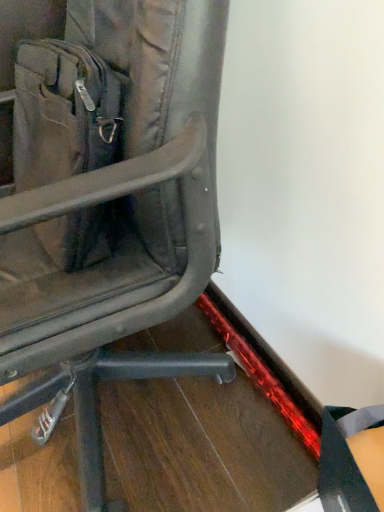
What do you see at coordinates (105, 198) in the screenshot?
I see `matte black chair at center` at bounding box center [105, 198].

What is the approximate height of matte black chair at center?

31.99 inches.

Where is `matte black chair at center`? matte black chair at center is located at coordinates (105, 198).

What is the approximate width of matte black chair at center?

matte black chair at center is 24.42 inches in width.

Locate an element on the screen. This screenshot has height=512, width=384. matte black messenger bag at left is located at coordinates 62,113.

The height and width of the screenshot is (512, 384). Describe the element at coordinates (62, 113) in the screenshot. I see `matte black messenger bag at left` at that location.

I want to click on matte black chair at center, so click(105, 198).

Which object is positioned more to the left, matte black chair at center or matte black messenger bag at left?

matte black messenger bag at left.

Is matte black chair at center closer to the viewer compared to matte black messenger bag at left?

Yes, the depth of matte black chair at center is less than that of matte black messenger bag at left.

Considering the points (61, 78) and (92, 234), which point is in front, point (61, 78) or point (92, 234)?

The point (92, 234) is more forward.

From the image's perspective, is matte black chair at center under matte black messenger bag at left?

Yes, from the image's perspective, matte black chair at center is below matte black messenger bag at left.

From a real-world perspective, is matte black chair at center physically located above or below matte black messenger bag at left?

In terms of real-world spatial position, matte black chair at center is below matte black messenger bag at left.

Consider the image. Between matte black chair at center and matte black messenger bag at left, which one has larger width?

Wider between the two is matte black chair at center.

Which of these two, matte black chair at center or matte black messenger bag at left, stands shorter?

Standing shorter between the two is matte black messenger bag at left.

Who is bigger, matte black chair at center or matte black messenger bag at left?

With larger size is matte black chair at center.

Is matte black chair at center not inside matte black messenger bag at left?

Yes, matte black chair at center is located beyond the bounds of matte black messenger bag at left.

Is matte black chair at center far away from matte black messenger bag at left?

matte black chair at center is actually quite close to matte black messenger bag at left.

Is matte black chair at center facing towards matte black messenger bag at left?

Yes.

Locate an element on the screen. chair that appears in front of the matte black messenger bag at left is located at coordinates (105, 198).

Which object is positioned more to the left, matte black messenger bag at left or matte black chair at center?

matte black messenger bag at left is more to the left.

Does matte black messenger bag at left come behind matte black chair at center?

Yes, matte black messenger bag at left is further from the viewer.

Is point (55, 87) closer to viewer compared to point (191, 230)?

No, (55, 87) is further to viewer.

From the image's perspective, relative to matte black chair at center, is matte black messenger bag at left above or below?

Based on their image positions, matte black messenger bag at left is located above matte black chair at center.

From a real-world perspective, relative to matte black chair at center, is matte black messenger bag at left vertically above or below?

In terms of real-world spatial position, matte black messenger bag at left is above matte black chair at center.

From the picture: Does matte black messenger bag at left have a lesser width compared to matte black chair at center?

Correct, the width of matte black messenger bag at left is less than that of matte black chair at center.

Does matte black messenger bag at left have a lesser height compared to matte black chair at center?

Yes, matte black messenger bag at left is shorter than matte black chair at center.

From the picture: In terms of size, does matte black messenger bag at left appear bigger or smaller than matte black chair at center?

matte black messenger bag at left is smaller than matte black chair at center.

Is matte black chair at center completely or partially inside matte black messenger bag at left?

No, matte black chair at center is located outside of matte black messenger bag at left.

Are matte black messenger bag at left and matte black chair at center far apart?

No, matte black messenger bag at left is not far away from matte black chair at center.

Does matte black messenger bag at left turn towards matte black chair at center?

Yes, matte black messenger bag at left faces towards matte black chair at center.

How different are the orientations of matte black messenger bag at left and matte black chair at center in degrees?

The angle between the facing direction of matte black messenger bag at left and the facing direction of matte black chair at center is 0.000709 degrees.

At what (x,y) coordinates should I click in order to perform the action: click on messenger bag that appears on the left of matte black chair at center. Please return your answer as a coordinate pair (x, y). This screenshot has width=384, height=512. Looking at the image, I should click on (62, 113).

Locate an element on the screen. The image size is (384, 512). messenger bag above the matte black chair at center (from the image's perspective) is located at coordinates (62, 113).

Locate an element on the screen. chair below the matte black messenger bag at left (from the image's perspective) is located at coordinates (105, 198).